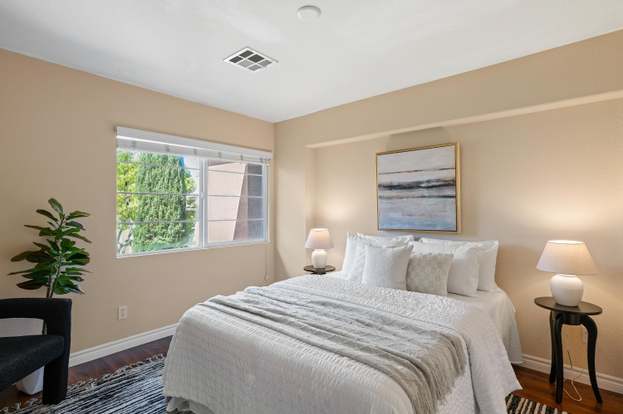
I want to click on pillow menu, so click(x=387, y=268), click(x=364, y=263), click(x=352, y=256), click(x=424, y=273), click(x=458, y=274), click(x=485, y=263).